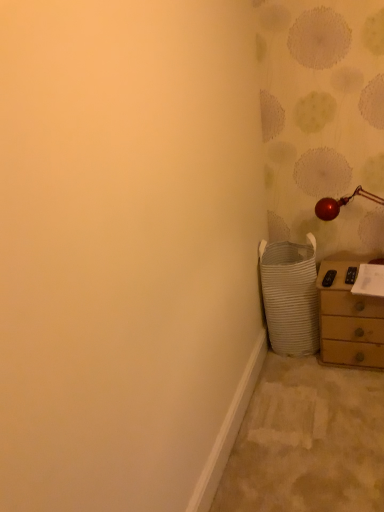
What is the approximate width of wooden chest of drawers at right?

15.78 inches.

Measure the distance between wooden chest of drawers at right and camera.

A distance of 2.09 meters exists between wooden chest of drawers at right and camera.

Find the location of a particular element. Image resolution: width=384 pixels, height=512 pixels. wooden chest of drawers at right is located at coordinates (349, 315).

Image resolution: width=384 pixels, height=512 pixels. What do you see at coordinates (349, 315) in the screenshot?
I see `wooden chest of drawers at right` at bounding box center [349, 315].

Find the location of a particular element. wooden chest of drawers at right is located at coordinates (349, 315).